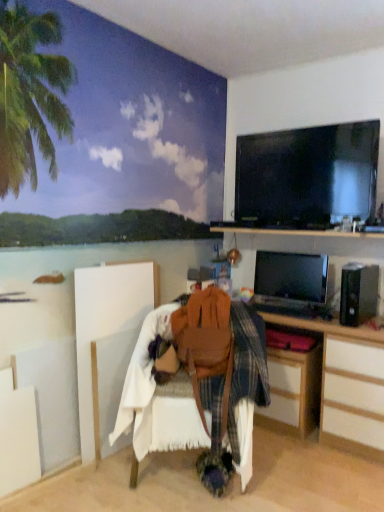
You are a GUI agent. You are given a task and a screenshot of the screen. Output one action in this format:
    pyautogui.click(x=<x>, y=<y>)
    Task: Click on the free space above black glossy screen at upper right, the first television positioned from the top (from a real-world perspective)
    The width and height of the screenshot is (384, 512).
    Given the screenshot: What is the action you would take?
    pyautogui.click(x=314, y=126)